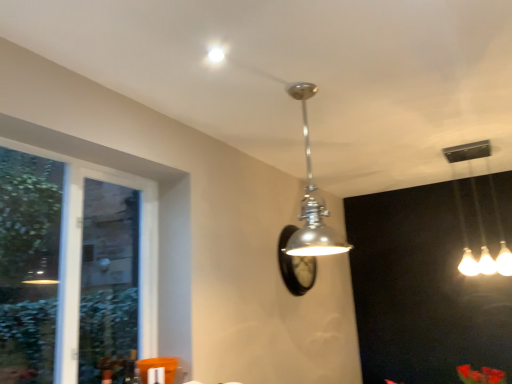
Question: Considering the relative positions of polished chrome pendant light at center, the first lamp in the front-to-back sequence, and clear glass window at left in the image provided, is polished chrome pendant light at center, the first lamp in the front-to-back sequence, to the left or to the right of clear glass window at left?

Choices:
 (A) left
 (B) right

Answer: (B)

Question: Which is correct: polished chrome pendant light at center, positioned as the second lamp in back-to-front order, is inside clear glass window at left, or outside of it?

Choices:
 (A) outside
 (B) inside

Answer: (A)

Question: Considering the real-world distances, which object is farthest from the matte silver droplight at upper center?

Choices:
 (A) rubberized plastic flowers at center
 (B) white glossy light fixture at upper right, the 2th lamp when ordered from left to right
 (C) clear glass window at left
 (D) polished chrome pendant light at center, which is counted as the first lamp, starting from the left

Answer: (B)

Question: Which object is positioned closest to the rubberized plastic flowers at center?

Choices:
 (A) matte silver droplight at upper center
 (B) white glossy light fixture at upper right, which appears as the 2th lamp when viewed from the front
 (C) clear glass window at left
 (D) polished chrome pendant light at center, which is the 2th lamp in right-to-left order

Answer: (B)